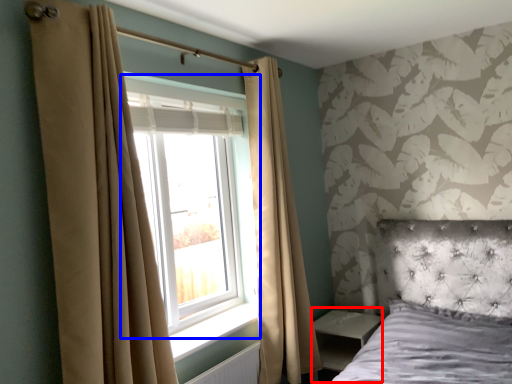
Question: Which object appears closest to the camera in this image, side table (highlighted by a red box) or window (highlighted by a blue box)?

Choices:
 (A) side table
 (B) window

Answer: (B)